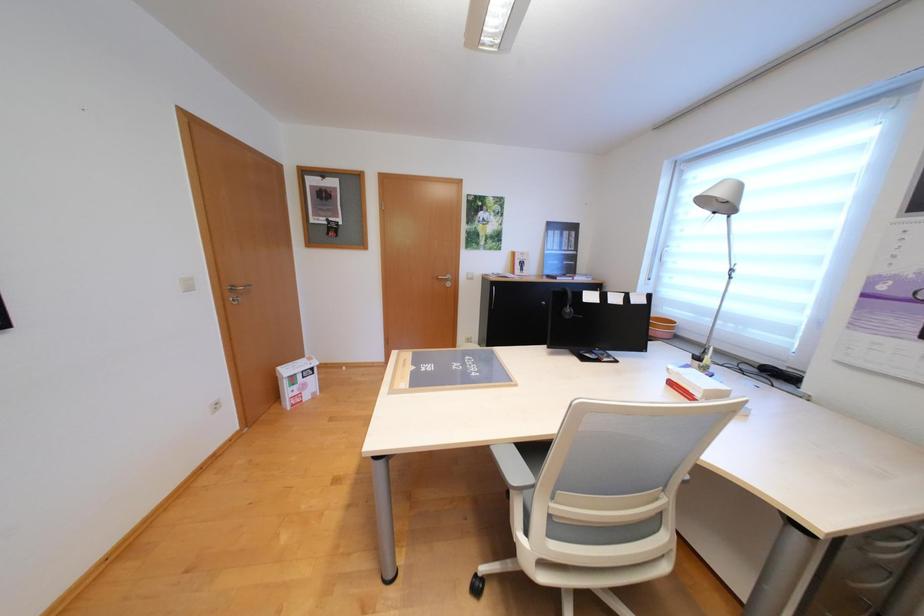
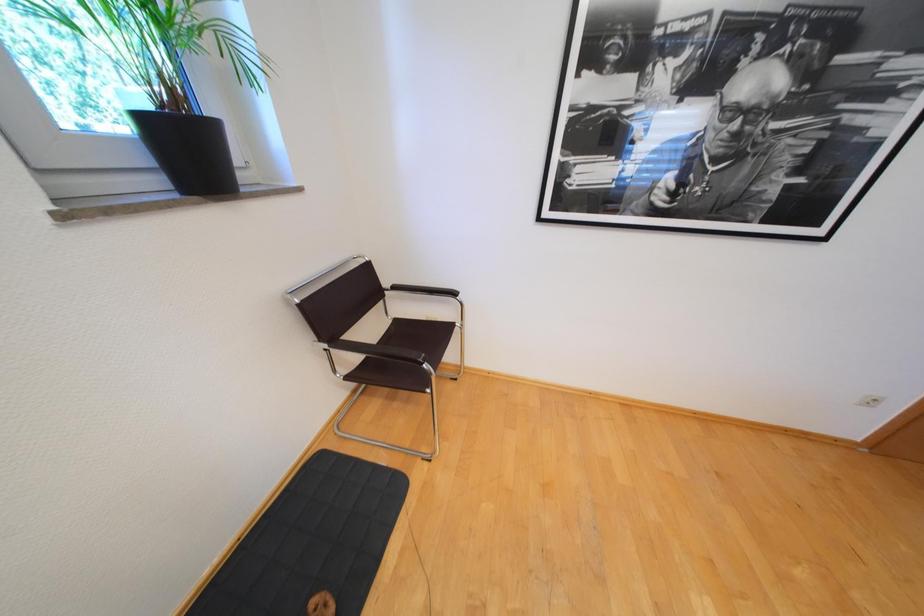
Based on the continuous images, in which direction is the camera rotating?

The camera's rotation is toward left-down.